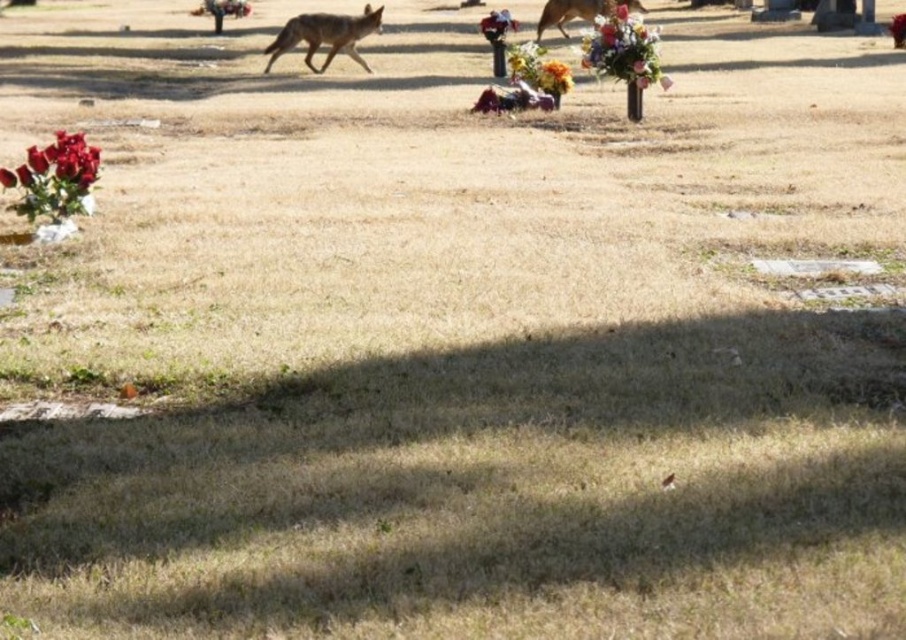
Question: From the image, what is the correct spatial relationship of brown fur coyote at upper center in relation to matte floral bouquet at center?

Choices:
 (A) right
 (B) left

Answer: (B)

Question: Which of the following is the closest to the observer?

Choices:
 (A) (489, 35)
 (B) (382, 8)
 (C) (562, 33)

Answer: (A)

Question: Considering the relative positions of floral bouquet at upper center and floral bouquet at center in the image provided, where is floral bouquet at upper center located with respect to floral bouquet at center?

Choices:
 (A) below
 (B) above

Answer: (A)

Question: Estimate the real-world distances between objects in this image. Which object is farther from the floral bouquet at upper center?

Choices:
 (A) brown fur coyote at upper center
 (B) matte floral bouquet at center
 (C) smooth plastic vase at center
 (D) floral bouquet at center

Answer: (C)

Question: Where is brown fur coyote at upper center located in relation to floral bouquet at center in the image?

Choices:
 (A) above
 (B) below

Answer: (A)

Question: Which point appears closest to the camera in this image?

Choices:
 (A) (507, 22)
 (B) (528, 44)

Answer: (B)